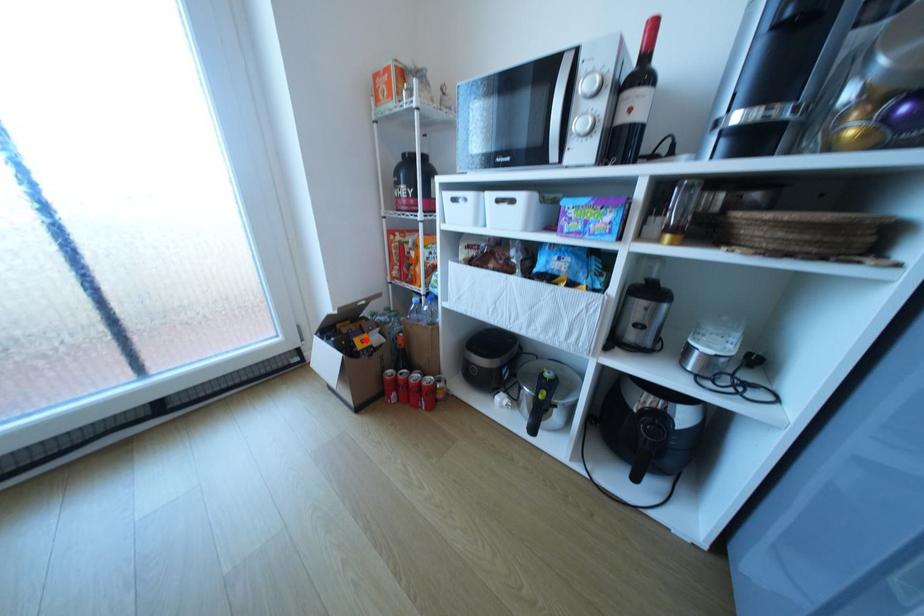
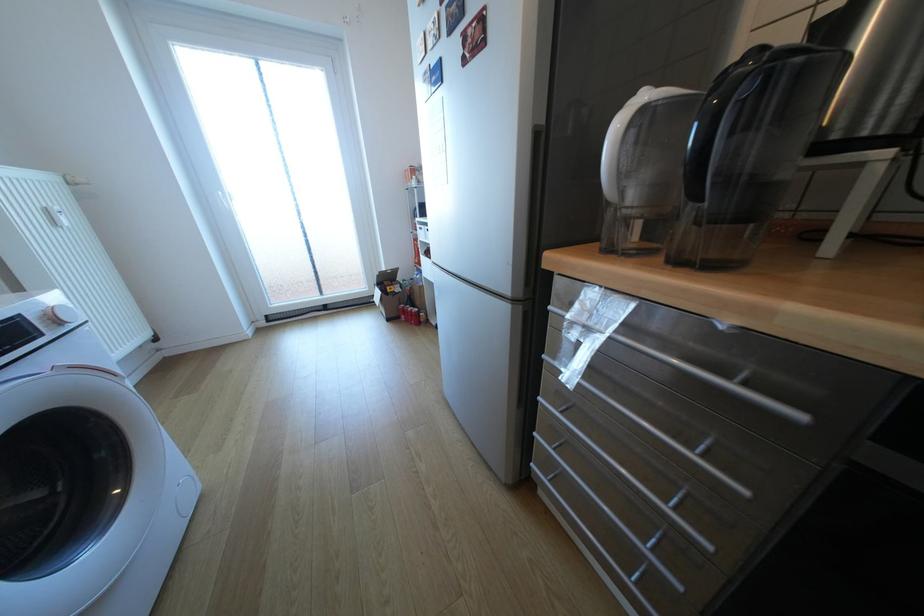
In the second image, find the point that corresponds to the highlighted location in the first image.

(397, 288)